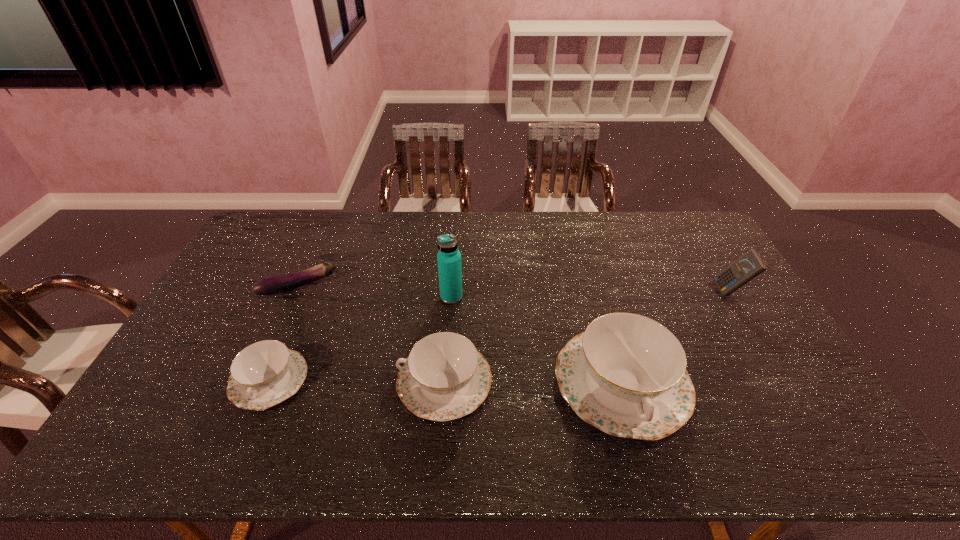
You are a GUI agent. You are given a task and a screenshot of the screen. Output one action in this format:
    pyautogui.click(x=<x>, y=<y>)
    Task: Click on the vacant region at the near edge of the desktop
    The width and height of the screenshot is (960, 540).
    Given the screenshot: What is the action you would take?
    pyautogui.click(x=213, y=416)

The height and width of the screenshot is (540, 960). In the image, there is a desktop. Find the location of `blank space at the left edge`. blank space at the left edge is located at coordinates (214, 333).

In the image, there is a desktop. Identify the location of free space at the right edge. (749, 325).

You are a GUI agent. You are given a task and a screenshot of the screen. Output one action in this format:
    pyautogui.click(x=<x>, y=<y>)
    Task: Click on the free space at the far left corner
    
    Given the screenshot: What is the action you would take?
    pyautogui.click(x=284, y=246)

Locate an element on the screen. free space at the far right corner of the desktop is located at coordinates (676, 227).

Find the location of `blank space at the near right corner`. blank space at the near right corner is located at coordinates (772, 405).

At what (x,y) coordinates should I click in order to perform the action: click on free spot between the rightmost chinaware and the water bottle. Please return your answer as a coordinate pair (x, y). Looking at the image, I should click on (537, 340).

Find the location of a particular element. unoccupied area between the second shortest chinaware and the eggplant is located at coordinates (372, 334).

Where is `vacant space that is in between the tallest object and the shortest chinaware`? The height and width of the screenshot is (540, 960). vacant space that is in between the tallest object and the shortest chinaware is located at coordinates (360, 339).

Locate an element on the screen. The width and height of the screenshot is (960, 540). unoccupied area between the calculator and the tallest object is located at coordinates (590, 294).